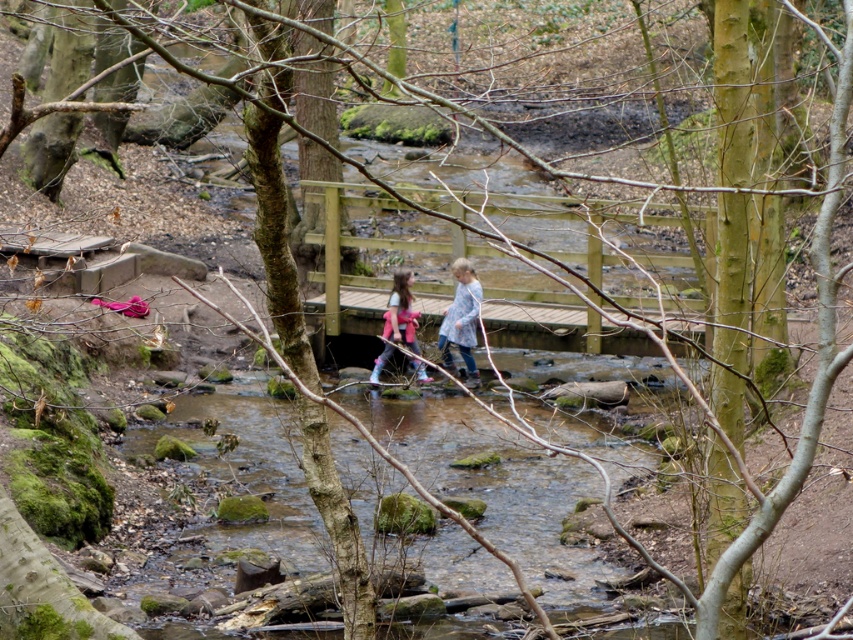
Where is `wooden bridge at center`? This screenshot has width=853, height=640. wooden bridge at center is located at coordinates (534, 317).

Who is positioned more to the right, wooden bridge at center or plaid fabric shirt at center?

Positioned to the right is wooden bridge at center.

The image size is (853, 640). Describe the element at coordinates (534, 317) in the screenshot. I see `wooden bridge at center` at that location.

Locate an element on the screen. The height and width of the screenshot is (640, 853). wooden bridge at center is located at coordinates (534, 317).

Which is in front, point (532, 412) or point (456, 301)?

Point (532, 412)

Is point (347, 454) closer to camera compared to point (457, 289)?

Yes, it is in front of point (457, 289).

Where is `clear water at stream center`? The image size is (853, 640). clear water at stream center is located at coordinates (482, 468).

Which of these two, wooden bridge at center or pink fabric backpack at center, stands taller?

wooden bridge at center is taller.

Is wooden bridge at center to the right of pink fabric backpack at center from the viewer's perspective?

Indeed, wooden bridge at center is positioned on the right side of pink fabric backpack at center.

Image resolution: width=853 pixels, height=640 pixels. What are the coordinates of `wooden bridge at center` in the screenshot? It's located at (534, 317).

Identify the location of wooden bridge at center. (534, 317).